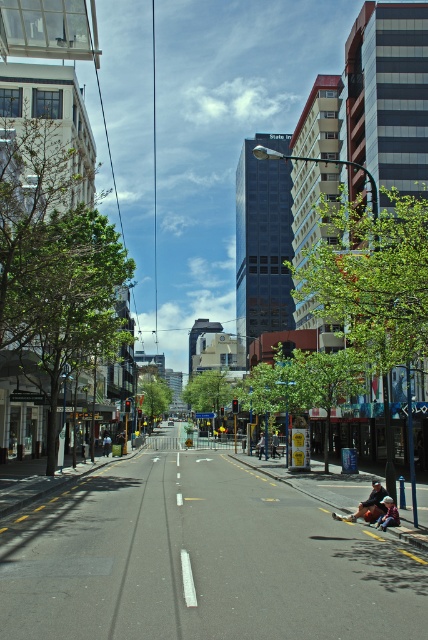
Who is more forward, (369, 515) or (107, 438)?

Positioned in front is point (369, 515).

In the scene shown: Does leather jacket at lower right appear over dark blue jeans at center?

Correct, leather jacket at lower right is located above dark blue jeans at center.

This screenshot has width=428, height=640. Describe the element at coordinates (371, 504) in the screenshot. I see `leather jacket at lower right` at that location.

The image size is (428, 640). I want to click on leather jacket at lower right, so click(371, 504).

Who is shorter, denim jacket at lower right or blue denim jeans at center?

With less height is denim jacket at lower right.

Identify the location of denim jacket at lower right. This screenshot has height=640, width=428. (388, 515).

This screenshot has height=640, width=428. What do you see at coordinates (388, 515) in the screenshot?
I see `denim jacket at lower right` at bounding box center [388, 515].

Locate an element on the screen. denim jacket at lower right is located at coordinates (388, 515).

Can you confirm if blue denim jeans at center is shorter than denim jacket at center?

In fact, blue denim jeans at center may be taller than denim jacket at center.

Which is more to the left, blue denim jeans at center or denim jacket at center?

From the viewer's perspective, blue denim jeans at center appears more on the left side.

Between point (264, 451) and point (273, 438), which one is positioned in front?

Point (264, 451) is more forward.

The width and height of the screenshot is (428, 640). Identify the location of blue denim jeans at center. (261, 445).